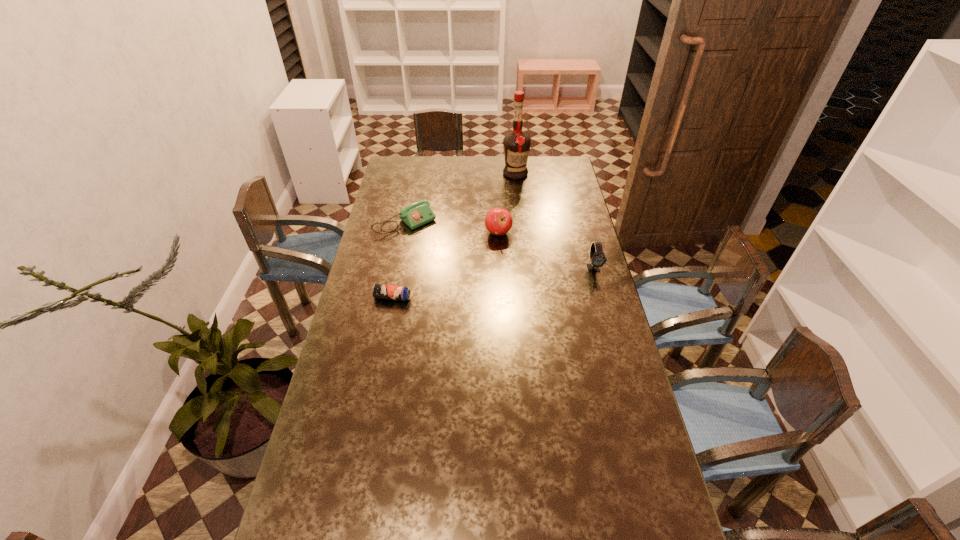
Locate an element on the screen. The width and height of the screenshot is (960, 540). vacant space on the desktop that is between the shortest object and the rightmost object and is positioned on the stem of the apple is located at coordinates (468, 286).

Locate an element on the screen. The height and width of the screenshot is (540, 960). vacant space on the desktop that is between the beer can and the second nearest object and is positioned on the front and back of the tallest object is located at coordinates (483, 284).

This screenshot has height=540, width=960. I want to click on vacant spot on the desktop that is between the shortest object and the watch and is positioned on the dial of the second shortest object, so click(472, 286).